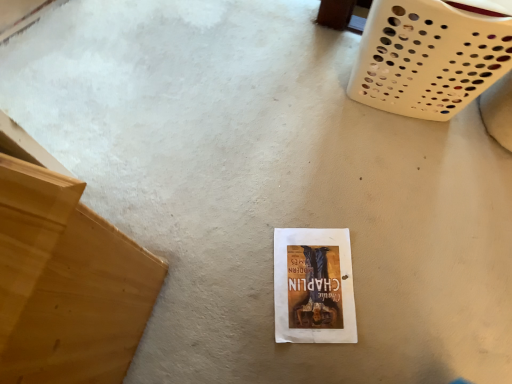
Locate an element on the screen. vacant space to the left of white plastic basket at upper right is located at coordinates (286, 76).